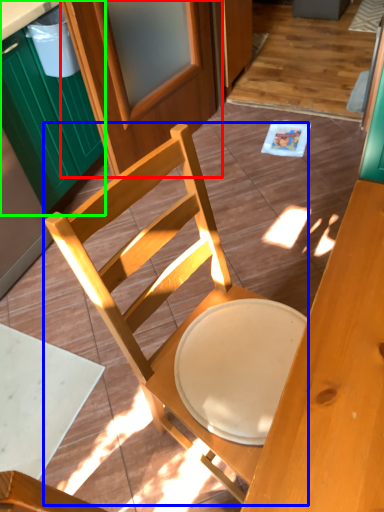
Question: Which is farther away from screen door (highlighted by a red box)? chair (highlighted by a blue box) or cabinetry (highlighted by a green box)?

Choices:
 (A) chair
 (B) cabinetry

Answer: (A)